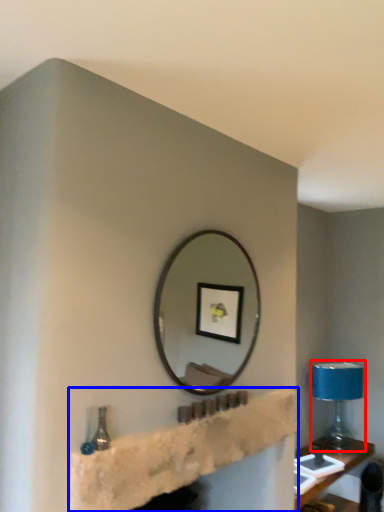
Question: Which of the following is the farthest to the observer, table lamp (highlighted by a red box) or shelf (highlighted by a blue box)?

Choices:
 (A) table lamp
 (B) shelf

Answer: (A)